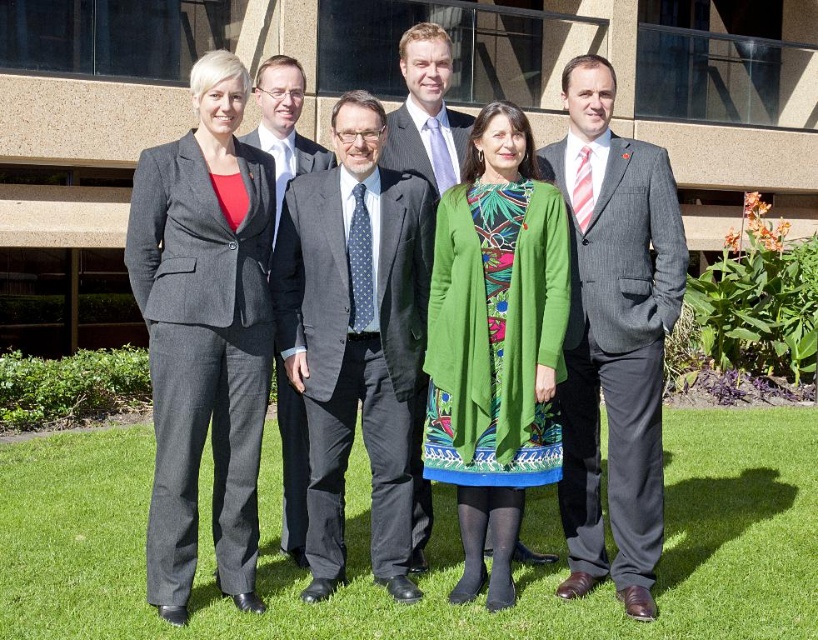
Who is more forward, (x=416, y=157) or (x=275, y=232)?

Positioned in front is point (x=275, y=232).

Does polished gray suit at center appear on the right side of matte gray suit at center?

Indeed, polished gray suit at center is positioned on the right side of matte gray suit at center.

Is point (399, 132) more distant than point (259, 147)?

That is True.

Identify the location of polished gray suit at center. (425, 113).

Does point (609, 484) come closer to viewer compared to point (452, 168)?

That is True.

Which is above, gray pinstripe suit at center or matte black suit at center?

Positioned higher is matte black suit at center.

Does point (646, 502) lie in front of point (402, 150)?

Yes, point (646, 502) is in front of point (402, 150).

You are a GUI agent. You are given a task and a screenshot of the screen. Output one action in this format:
    pyautogui.click(x=<x>, y=<y>)
    Task: Click on the gray pinstripe suit at center
    The width and height of the screenshot is (818, 640).
    Given the screenshot: What is the action you would take?
    pyautogui.click(x=614, y=336)

Who is lower down, green textured dress at center or matte black suit at center?

green textured dress at center

This screenshot has width=818, height=640. What do you see at coordinates (495, 342) in the screenshot?
I see `green textured dress at center` at bounding box center [495, 342].

Which is behind, point (529, 406) or point (464, 120)?

Positioned behind is point (464, 120).

This screenshot has width=818, height=640. In order to click on green textured dress at center in this screenshot , I will do `click(495, 342)`.